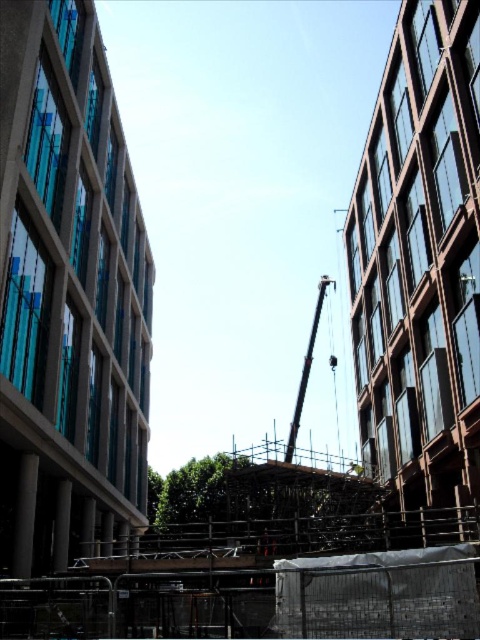
Question: Does wooden scaffolding at center have a greater width compared to metallic gray crane at center?

Choices:
 (A) yes
 (B) no

Answer: (A)

Question: Can you confirm if wooden scaffolding at center is wider than metallic gray crane at center?

Choices:
 (A) no
 (B) yes

Answer: (B)

Question: Which of the following is the farthest from the observer?

Choices:
 (A) metallic gray crane at center
 (B) wooden scaffolding at center

Answer: (A)

Question: Observing the image, what is the correct spatial positioning of wooden scaffolding at center in reference to metallic gray crane at center?

Choices:
 (A) above
 (B) below

Answer: (B)

Question: Which of the following is the farthest from the observer?

Choices:
 (A) (299, 417)
 (B) (113, 588)

Answer: (A)